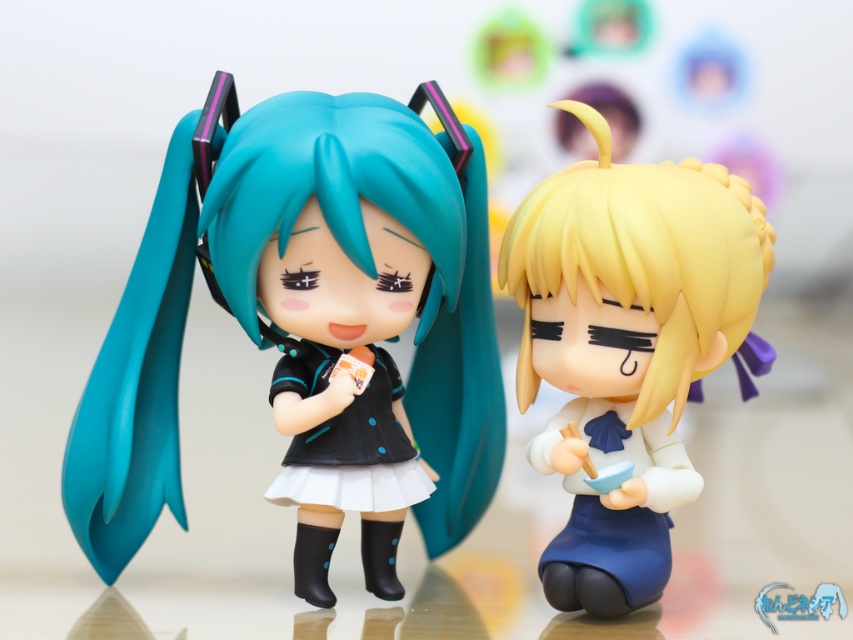
You are arranging two Nendoroid figurines on a shelf. The matte black figure at left and the satin blonde hair at right are currently positioned such that one is above the other. Which one should you move to make them stand side by side horizontally?

The matte black figure at left is located above the satin blonde hair at right. To make them stand side by side horizontally, you should move the matte black figure at left down to the same level as the satin blonde hair at right.

You are arranging a display for a collector. You need to place a new figurine between the matte black figure at left and the satin blonde hair at right. Based on their current positions, which side should you place the new figurine to ensure it is centered between them?

The new figurine should be placed between the matte black figure at left and the satin blonde hair at right, centered between them since the matte black figure at left is to the left of the satin blonde hair at right.